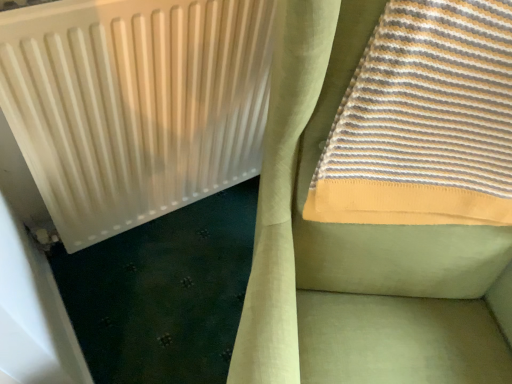
Question: Considering their positions, is striped cotton towel at upper right located in front of or behind white matte radiator at upper left?

Choices:
 (A) behind
 (B) front

Answer: (B)

Question: Is striped cotton towel at upper right wider or thinner than white matte radiator at upper left?

Choices:
 (A) wide
 (B) thin

Answer: (A)

Question: Choose the correct answer: Is striped cotton towel at upper right inside white matte radiator at upper left or outside it?

Choices:
 (A) outside
 (B) inside

Answer: (A)

Question: Considering their positions, is white matte radiator at upper left located in front of or behind striped cotton towel at upper right?

Choices:
 (A) behind
 (B) front

Answer: (A)

Question: From the image's perspective, is white matte radiator at upper left above or below striped cotton towel at upper right?

Choices:
 (A) below
 (B) above

Answer: (A)

Question: In the image, is white matte radiator at upper left on the left side or the right side of striped cotton towel at upper right?

Choices:
 (A) left
 (B) right

Answer: (A)

Question: In terms of height, does white matte radiator at upper left look taller or shorter compared to striped cotton towel at upper right?

Choices:
 (A) short
 (B) tall

Answer: (B)